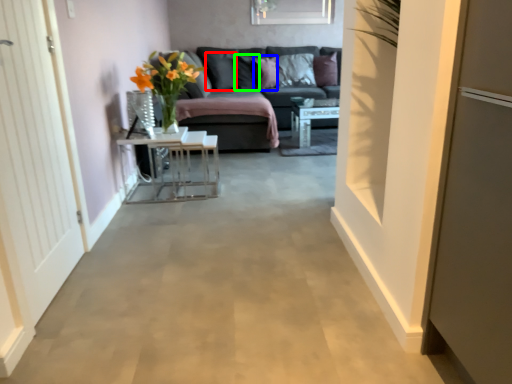
Question: Based on their relative distances, which object is nearer to pillow (highlighted by a red box)? Choose from pillow (highlighted by a blue box) and pillow (highlighted by a green box).

Choices:
 (A) pillow
 (B) pillow

Answer: (B)